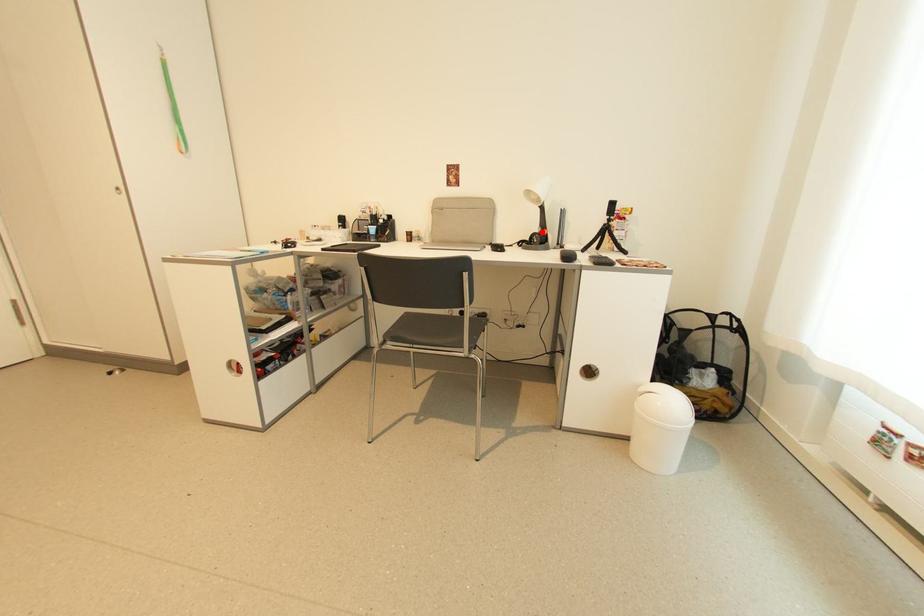
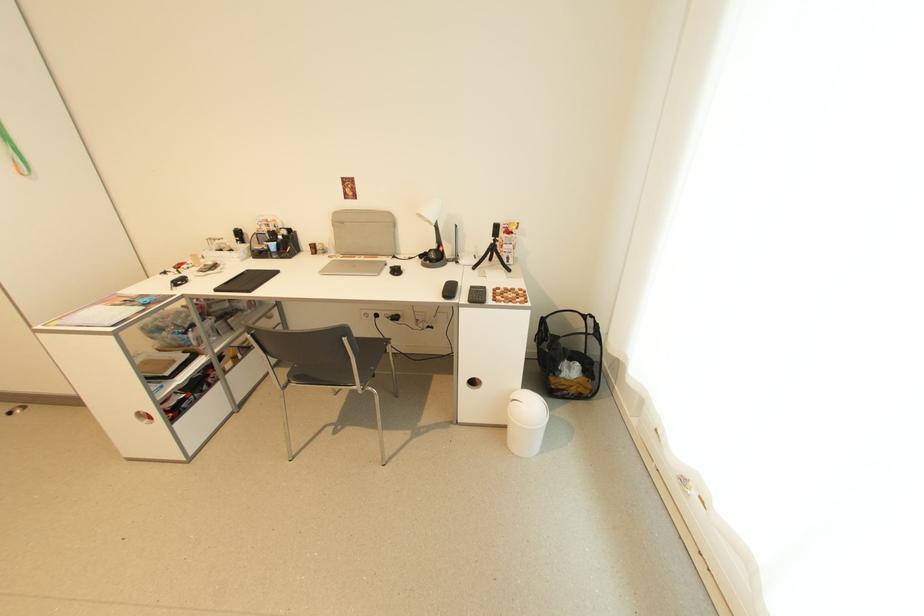
Find the pixel in the second image that matches the highlighted location in the first image.

(439, 248)